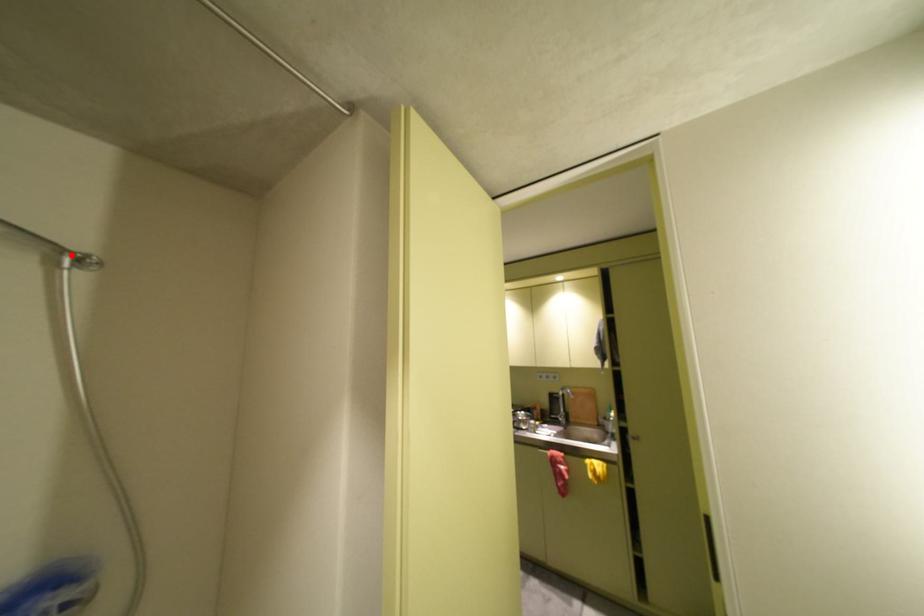
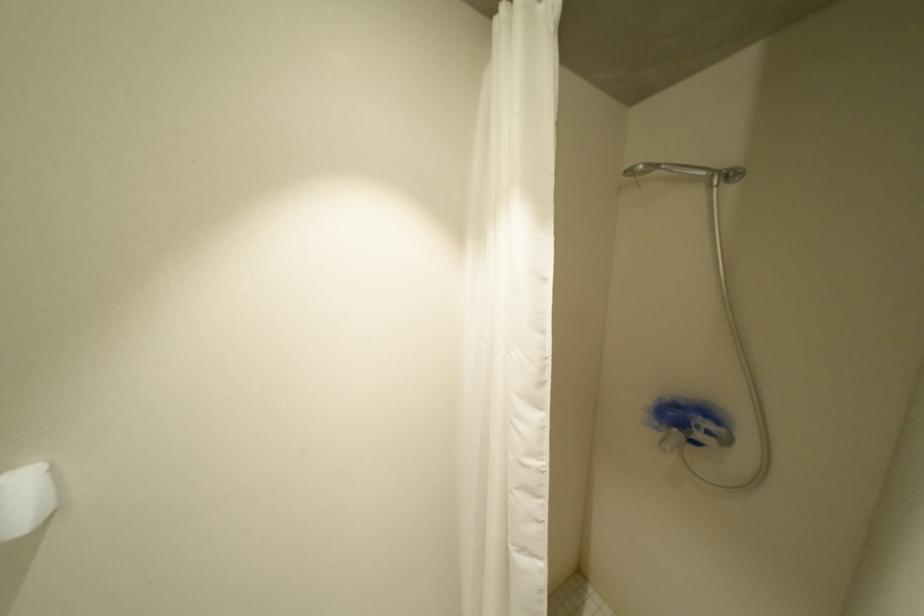
Locate, in the second image, the point that corresponds to the highlighted location in the first image.

(723, 176)